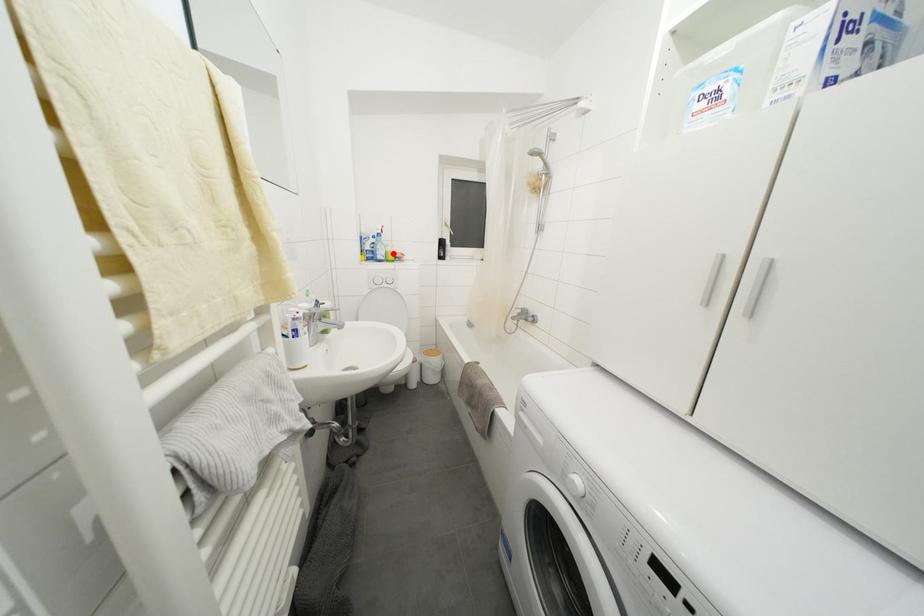
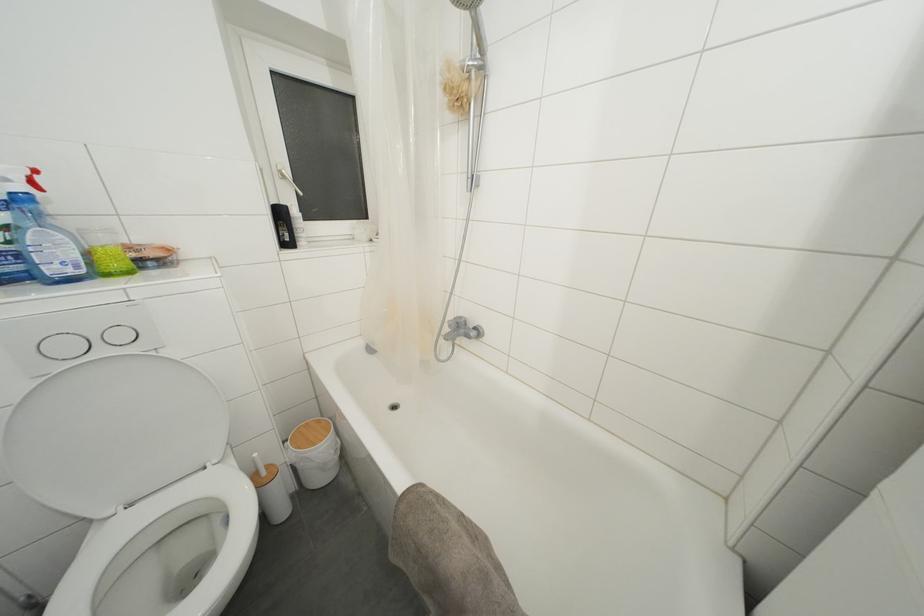
Where in the second image is the point corresponding to the highlighted location from the first image?

(108, 245)